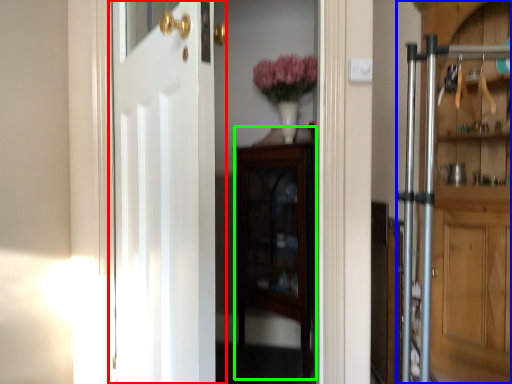
Question: Which is farther away from door (highlighted by a red box)? door (highlighted by a blue box) or cabinetry (highlighted by a green box)?

Choices:
 (A) door
 (B) cabinetry

Answer: (A)